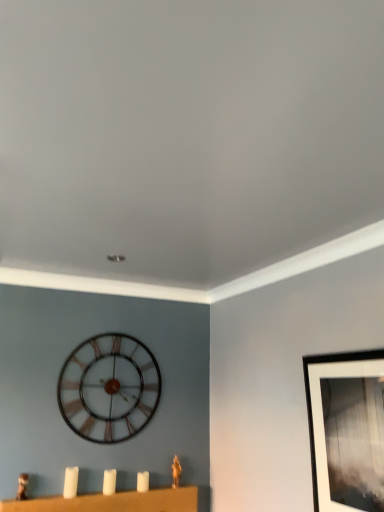
Describe the element at coordinates (70, 482) in the screenshot. I see `white matte candle at lower left` at that location.

Find the location of a particular element. metallic clock at center is located at coordinates (109, 388).

The image size is (384, 512). Describe the element at coordinates (112, 502) in the screenshot. I see `white matte candlesticks at lower center` at that location.

What are the coordinates of `white matte candle at lower left` in the screenshot? It's located at (70, 482).

In the image, is white matte candlesticks at lower center on the left side or the right side of black matte picture frame at upper right?

In the image, white matte candlesticks at lower center appears on the left side of black matte picture frame at upper right.

Is white matte candlesticks at lower center positioned with its back to black matte picture frame at upper right?

white matte candlesticks at lower center does not have its back to black matte picture frame at upper right.

In terms of height, does white matte candlesticks at lower center look taller or shorter compared to black matte picture frame at upper right?

In the image, white matte candlesticks at lower center appears to be shorter than black matte picture frame at upper right.

Is black matte picture frame at upper right a part of white matte candlesticks at lower center?

Actually, black matte picture frame at upper right is outside white matte candlesticks at lower center.

Is white matte candlesticks at lower center inside metallic clock at center?

That's incorrect, white matte candlesticks at lower center is not inside metallic clock at center.

From the image's perspective, is metallic clock at center under white matte candlesticks at lower center?

Actually, metallic clock at center appears above white matte candlesticks at lower center in the image.

The width and height of the screenshot is (384, 512). Identify the location of furniture in front of the metallic clock at center. (112, 502).

Which of these two, metallic clock at center or white matte candlesticks at lower center, is bigger?

white matte candlesticks at lower center.

Which is behind, point (381, 499) or point (86, 434)?

The point (86, 434) is farther from the camera.

Is there a large distance between black matte picture frame at upper right and metallic clock at center?

Indeed, black matte picture frame at upper right is not near metallic clock at center.

How many degrees apart are the facing directions of black matte picture frame at upper right and metallic clock at center?

black matte picture frame at upper right and metallic clock at center are facing 89.4 degrees away from each other.

Consider the image. Based on their sizes in the image, would you say black matte picture frame at upper right is bigger or smaller than metallic clock at center?

Considering their sizes, black matte picture frame at upper right takes up more space than metallic clock at center.

Does white matte candlesticks at lower center have a lesser height compared to metallic clock at center?

Yes, white matte candlesticks at lower center is shorter than metallic clock at center.

Which object is wider, white matte candlesticks at lower center or metallic clock at center?

white matte candlesticks at lower center is wider.

Is white matte candlesticks at lower center inside the boundaries of metallic clock at center, or outside?

white matte candlesticks at lower center is not enclosed by metallic clock at center.

Does point (78, 501) appear closer or farther from the camera than point (116, 373)?

Clearly, point (78, 501) is closer to the camera than point (116, 373).

Considering the sizes of objects metallic clock at center and white matte candle at lower left in the image provided, who is shorter, metallic clock at center or white matte candle at lower left?

white matte candle at lower left.

From a real-world perspective, which object stands above the other?

From a 3D spatial view, metallic clock at center is above.

Could you tell me if metallic clock at center is facing white matte candle at lower left?

No, metallic clock at center is not facing towards white matte candle at lower left.

From the image's perspective, which is below, metallic clock at center or white matte candle at lower left?

white matte candle at lower left is shown below in the image.

Is white matte candle at lower left taller than white matte candlesticks at lower center?

No.

Can we say white matte candle at lower left lies outside white matte candlesticks at lower center?

white matte candle at lower left is positioned outside white matte candlesticks at lower center.

Where is `furniture on the right side of white matte candle at lower left`? furniture on the right side of white matte candle at lower left is located at coordinates (112, 502).

What's the angular difference between white matte candle at lower left and white matte candlesticks at lower center's facing directions?

The angle between the facing direction of white matte candle at lower left and the facing direction of white matte candlesticks at lower center is 0.398 degrees.

Which of these two, white matte candle at lower left or metallic clock at center, is smaller?

Smaller between the two is white matte candle at lower left.

Based on the photo, from a real-world perspective, is white matte candle at lower left over metallic clock at center?

Actually, white matte candle at lower left is physically below metallic clock at center in the real world.

Locate an element on the screen. wall clock above the white matte candle at lower left (from the image's perspective) is located at coordinates (109, 388).

Are white matte candle at lower left and metallic clock at center making contact?

Result: No, white matte candle at lower left is not touching metallic clock at center.

The image size is (384, 512). In the image, there is a white matte candlesticks at lower center. In order to click on picture frame above it (from the image's perspective) in this screenshot , I will do `click(346, 429)`.

Find the location of `furniture in front of the metallic clock at center`. furniture in front of the metallic clock at center is located at coordinates 112,502.

When comparing their distances from white matte candle at lower left, does metallic clock at center or black matte picture frame at upper right seem closer?

metallic clock at center lies closer to white matte candle at lower left than the other object.

Estimate the real-world distances between objects in this image. Which object is closer to white matte candlesticks at lower center, black matte picture frame at upper right or white matte candle at lower left?

Based on the image, white matte candle at lower left appears to be nearer to white matte candlesticks at lower center.

Based on their spatial positions, is white matte candlesticks at lower center or metallic clock at center closer to black matte picture frame at upper right?

white matte candlesticks at lower center is positioned closer to the anchor black matte picture frame at upper right.

Based on their spatial positions, is white matte candle at lower left or black matte picture frame at upper right closer to white matte candlesticks at lower center?

The object closer to white matte candlesticks at lower center is white matte candle at lower left.

Estimate the real-world distances between objects in this image. Which object is closer to black matte picture frame at upper right, metallic clock at center or white matte candle at lower left?

metallic clock at center.

From the image, which object appears to be nearer to white matte candlesticks at lower center, white matte candle at lower left or metallic clock at center?

white matte candle at lower left lies closer to white matte candlesticks at lower center than the other object.

Looking at the image, which one is located further to white matte candle at lower left, metallic clock at center or white matte candlesticks at lower center?

metallic clock at center is further to white matte candle at lower left.

Based on their spatial positions, is white matte candlesticks at lower center or black matte picture frame at upper right further from white matte candle at lower left?

black matte picture frame at upper right is positioned further to the anchor white matte candle at lower left.

The image size is (384, 512). What are the coordinates of `furniture between metallic clock at center and black matte picture frame at upper right in the horizontal direction` in the screenshot? It's located at (112, 502).

This screenshot has height=512, width=384. What are the coordinates of `furniture between white matte candle at lower left and black matte picture frame at upper right` in the screenshot? It's located at (112, 502).

You are a GUI agent. You are given a task and a screenshot of the screen. Output one action in this format:
    pyautogui.click(x=<x>, y=<y>)
    Task: Click on the wall clock located between white matte candle at lower left and black matte picture frame at upper right in the left-right direction
    This screenshot has width=384, height=512.
    Given the screenshot: What is the action you would take?
    pyautogui.click(x=109, y=388)

This screenshot has width=384, height=512. Find the location of `candle between metallic clock at center and white matte candlesticks at lower center in the vertical direction`. candle between metallic clock at center and white matte candlesticks at lower center in the vertical direction is located at coordinates (70, 482).